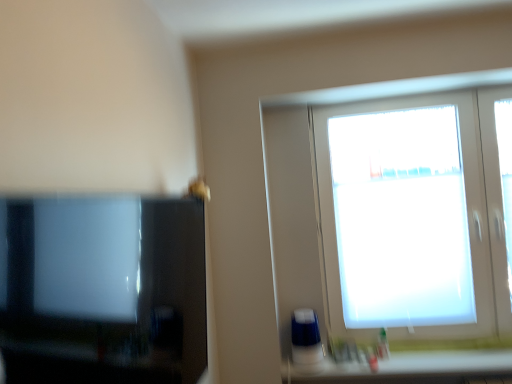
Locate an element on the screen. free space in front of translucent plastic bottle at lower right is located at coordinates tap(388, 365).